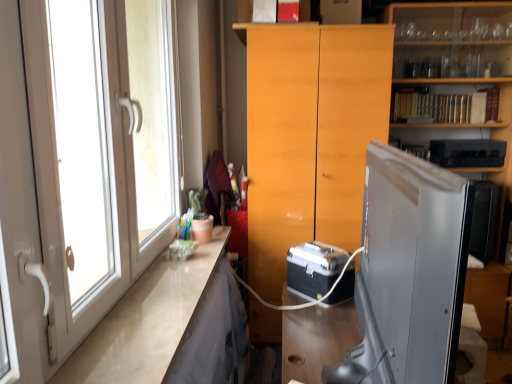
At what (x,y) coordinates should I click in order to perform the action: click on vacant space underneath white glossy door at left (from a real-world perspective). Please return your answer as a coordinate pair (x, y). The width and height of the screenshot is (512, 384). Looking at the image, I should click on tap(106, 328).